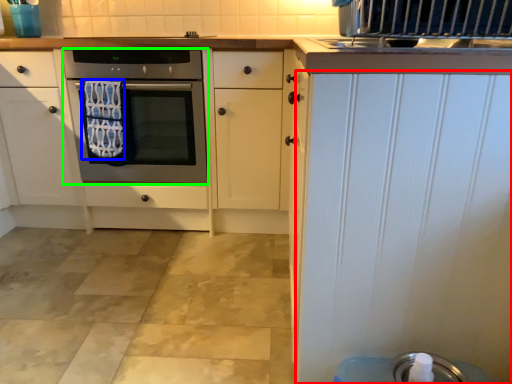
Question: Based on their relative distances, which object is nearer to door (highlighted by a red box)? Choose from bath towel (highlighted by a blue box) and oven (highlighted by a green box).

Choices:
 (A) bath towel
 (B) oven

Answer: (B)